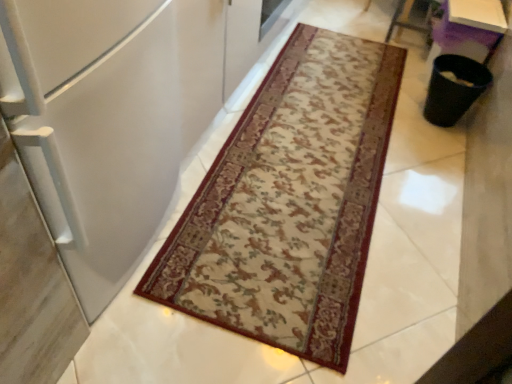
Question: Is beige carpet with floral pattern at center touching white matte refrigerator at left?

Choices:
 (A) no
 (B) yes

Answer: (A)

Question: Considering the relative sizes of beige carpet with floral pattern at center and white matte refrigerator at left in the image provided, is beige carpet with floral pattern at center shorter than white matte refrigerator at left?

Choices:
 (A) no
 (B) yes

Answer: (B)

Question: From a real-world perspective, is beige carpet with floral pattern at center over white matte refrigerator at left?

Choices:
 (A) no
 (B) yes

Answer: (A)

Question: From a real-world perspective, is beige carpet with floral pattern at center positioned under white matte refrigerator at left based on gravity?

Choices:
 (A) yes
 (B) no

Answer: (A)

Question: Can you confirm if beige carpet with floral pattern at center is positioned to the right of white matte refrigerator at left?

Choices:
 (A) yes
 (B) no

Answer: (A)

Question: Does beige carpet with floral pattern at center have a greater width compared to white matte refrigerator at left?

Choices:
 (A) yes
 (B) no

Answer: (A)

Question: Is purple plastic table at upper right positioned beyond the bounds of beige carpet with floral pattern at center?

Choices:
 (A) yes
 (B) no

Answer: (A)

Question: Is purple plastic table at upper right positioned in front of beige carpet with floral pattern at center?

Choices:
 (A) yes
 (B) no

Answer: (B)

Question: From the image's perspective, is purple plastic table at upper right located beneath beige carpet with floral pattern at center?

Choices:
 (A) no
 (B) yes

Answer: (A)

Question: Is purple plastic table at upper right to the left of beige carpet with floral pattern at center from the viewer's perspective?

Choices:
 (A) yes
 (B) no

Answer: (B)

Question: Can you confirm if purple plastic table at upper right is thinner than beige carpet with floral pattern at center?

Choices:
 (A) yes
 (B) no

Answer: (A)

Question: Could you tell me if purple plastic table at upper right is turned towards beige carpet with floral pattern at center?

Choices:
 (A) no
 (B) yes

Answer: (A)

Question: From a real-world perspective, is white matte refrigerator at left located higher than purple plastic table at upper right?

Choices:
 (A) no
 (B) yes

Answer: (B)